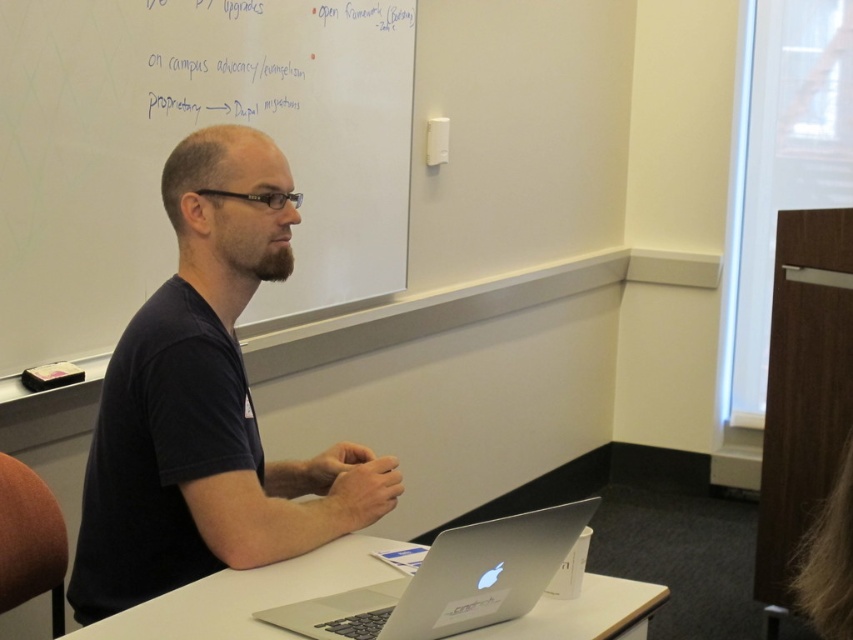
Question: Which is nearer to the white matte whiteboard at upper left?

Choices:
 (A) silver metallic laptop at center
 (B) sleek silver laptop at center

Answer: (A)

Question: Does black matte shirt at center appear over silver metallic laptop at center?

Choices:
 (A) yes
 (B) no

Answer: (A)

Question: Based on their relative distances, which object is farther from the black matte shirt at center?

Choices:
 (A) sleek silver laptop at center
 (B) silver metallic laptop at center

Answer: (A)

Question: Can you confirm if white matte whiteboard at upper left is positioned above black matte shirt at center?

Choices:
 (A) no
 (B) yes

Answer: (B)

Question: Can you confirm if white matte whiteboard at upper left is positioned to the left of sleek silver laptop at center?

Choices:
 (A) no
 (B) yes

Answer: (B)

Question: Which of the following is the closest to the observer?

Choices:
 (A) (497, 605)
 (B) (85, 470)
 (C) (360, 125)

Answer: (A)